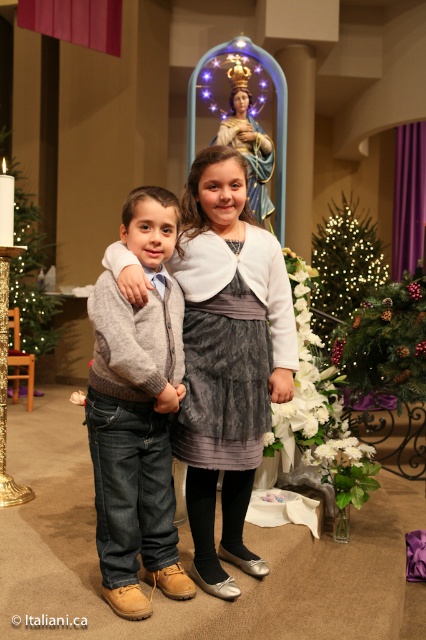
Is matte gray dress at center shorter than illuminated green christmas tree at center?

Incorrect, matte gray dress at center's height does not fall short of illuminated green christmas tree at center's.

Based on the photo, is matte gray dress at center thinner than illuminated green christmas tree at center?

Correct, matte gray dress at center's width is less than illuminated green christmas tree at center's.

Looking at this image, measure the distance between matte gray dress at center and camera.

matte gray dress at center and camera are 2.14 meters apart.

You are a GUI agent. You are given a task and a screenshot of the screen. Output one action in this format:
    pyautogui.click(x=<x>, y=<y>)
    Task: Click on the matte gray dress at center
    The width and height of the screenshot is (426, 640).
    Given the screenshot: What is the action you would take?
    pyautogui.click(x=227, y=356)

Who is lower down, knit sweater at center or green matte christmas tree at left?

knit sweater at center is lower down.

Is knit sweater at center positioned behind green matte christmas tree at left?

That is False.

You are a GUI agent. You are given a task and a screenshot of the screen. Output one action in this format:
    pyautogui.click(x=<x>, y=<y>)
    Task: Click on the knit sweater at center
    
    Given the screenshot: What is the action you would take?
    pyautogui.click(x=137, y=413)

Is point (195, 465) more distant than point (43, 307)?

No.

What do you see at coordinates (227, 356) in the screenshot? I see `matte gray dress at center` at bounding box center [227, 356].

The image size is (426, 640). What do you see at coordinates (227, 356) in the screenshot?
I see `matte gray dress at center` at bounding box center [227, 356].

Identify the location of matte gray dress at center. The width and height of the screenshot is (426, 640). (227, 356).